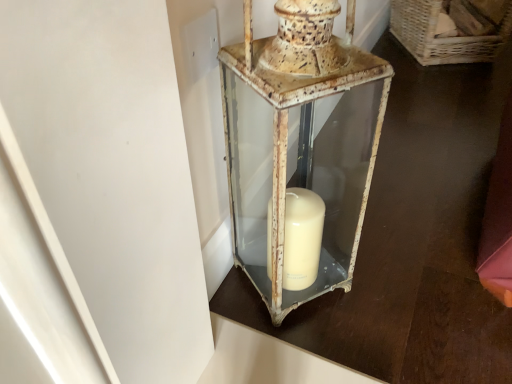
Identify the location of free spot in front of rusty metal lantern at center. The height and width of the screenshot is (384, 512). (338, 343).